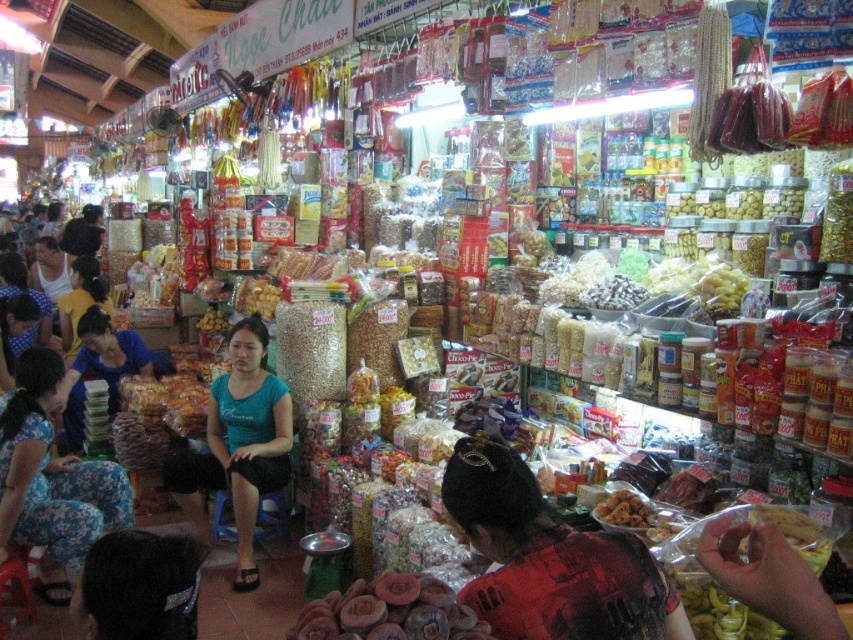
Can you confirm if floral fabric pants at lower left is positioned above purple matte dried mushrooms at lower center?

No.

Who is higher up, floral fabric pants at lower left or purple matte dried mushrooms at lower center?

purple matte dried mushrooms at lower center

The image size is (853, 640). I want to click on floral fabric pants at lower left, so click(x=51, y=481).

The height and width of the screenshot is (640, 853). I want to click on floral fabric pants at lower left, so click(51, 481).

Between floral fabric pants at lower left and blue fabric shirt at center, which one is positioned higher?

floral fabric pants at lower left is higher up.

Between floral fabric pants at lower left and blue fabric shirt at center, which one has more height?

blue fabric shirt at center is taller.

Where is `floral fabric pants at lower left`? The width and height of the screenshot is (853, 640). floral fabric pants at lower left is located at coordinates (51, 481).

Does blue fabric shirt at center have a greater height compared to purple matte dried mushrooms at lower center?

Yes.

Is blue fabric shirt at center closer to camera compared to purple matte dried mushrooms at lower center?

No.

Between point (202, 460) and point (340, 596), which one is positioned in front?

Positioned in front is point (340, 596).

The image size is (853, 640). Identify the location of blue fabric shirt at center. (241, 440).